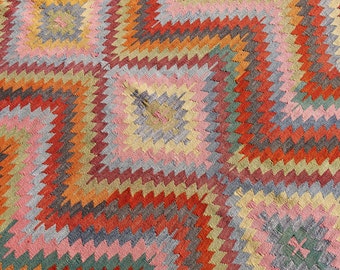
Where is `red yarn used to make rug or blanket`? red yarn used to make rug or blanket is located at coordinates (270, 154), (168, 197), (313, 88).